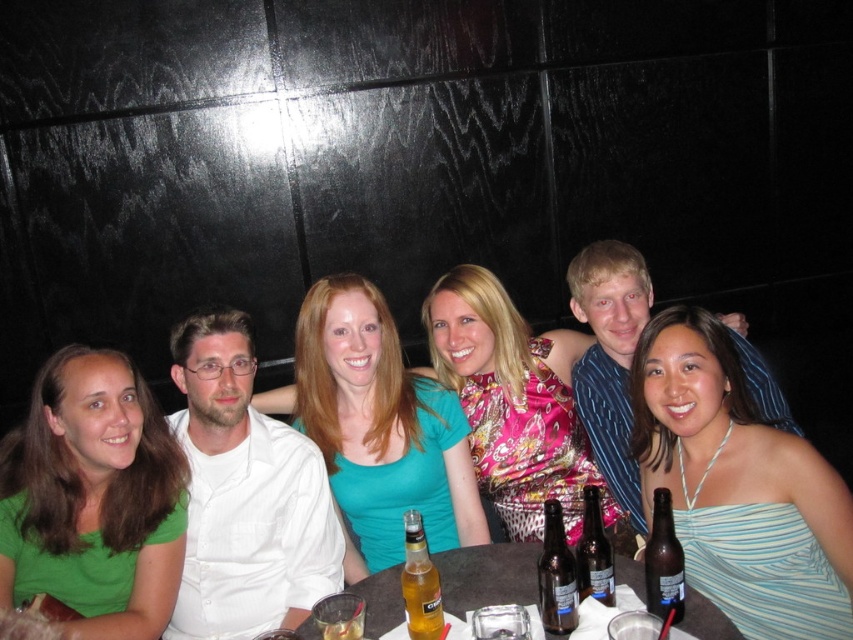
Is point (498, 509) in front of point (606, 573)?

No, it is not.

Can you confirm if shiny silk dress at center is positioned to the right of translucent glass bottle at center?

A: No, shiny silk dress at center is not to the right of translucent glass bottle at center.

Between point (532, 483) and point (576, 556), which one is positioned behind?

The point (532, 483) is more distant.

Where is `shiny silk dress at center`? This screenshot has width=853, height=640. shiny silk dress at center is located at coordinates (515, 404).

Between point (132, 516) and point (672, 547), which one is positioned in front?

Positioned in front is point (672, 547).

Which is above, green matte shirt at left or brown glass bottle at lower right?

Positioned higher is green matte shirt at left.

Locate an element on the screen. The image size is (853, 640). green matte shirt at left is located at coordinates (93, 499).

Is the position of translucent yellow glass bottle at lower center more distant than that of translucent glass bottle at center?

That is False.

Does translucent yellow glass bottle at lower center come in front of translucent glass bottle at center?

Yes, it is in front of translucent glass bottle at center.

Is point (427, 561) positioned before point (606, 600)?

Yes.

Locate an element on the screen. This screenshot has height=640, width=853. translucent yellow glass bottle at lower center is located at coordinates coord(421,582).